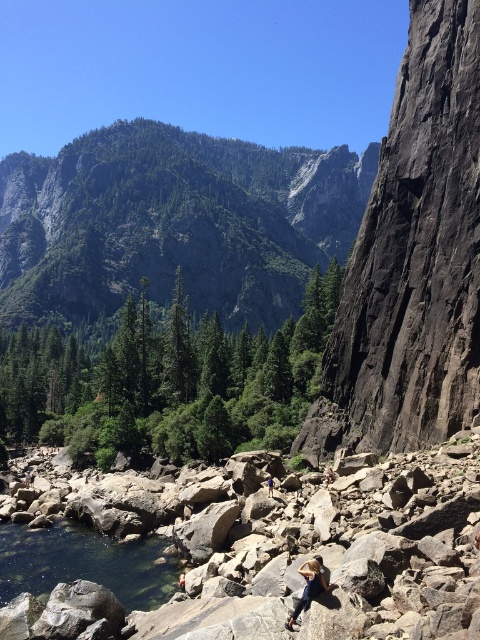
You are standing at the camera position and want to throw a stone to reach both the point at coordinate (384, 160) and the point at coordinate (162, 588). Which point is closer to you?

Point (162, 588) is closer to you than point (384, 160) because the latter is further away from the camera.